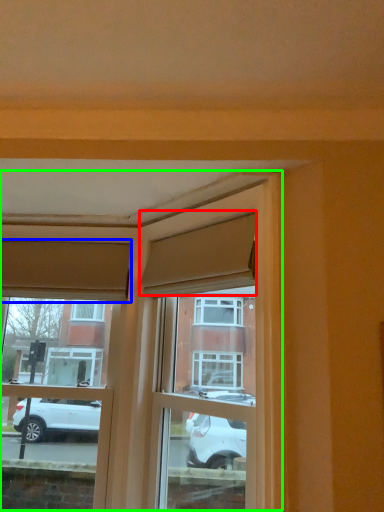
Question: Which object is the farthest from curtain (highlighted by a red box)? Choose among these: curtain (highlighted by a blue box) or window frame (highlighted by a green box).

Choices:
 (A) curtain
 (B) window frame

Answer: (A)